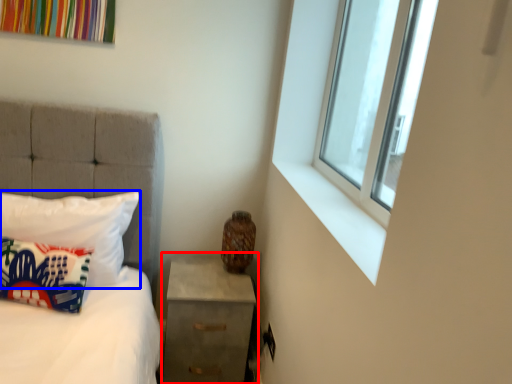
Question: Among these objects, which one is nearest to the camera, nightstand (highlighted by a red box) or pillow (highlighted by a blue box)?

Choices:
 (A) nightstand
 (B) pillow

Answer: (B)